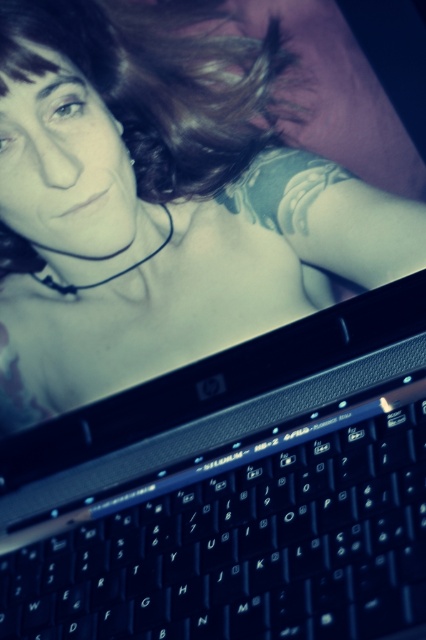
Question: Which object appears farthest from the camera in this image?

Choices:
 (A) matte black laptop at lower center
 (B) black plastic keyboard at bottom
 (C) dark brown curly hair at upper center

Answer: (C)

Question: Which of these objects is positioned closest to the dark brown curly hair at upper center?

Choices:
 (A) matte black laptop at lower center
 (B) black plastic keyboard at bottom

Answer: (A)

Question: Is matte black laptop at lower center bigger than black plastic keyboard at bottom?

Choices:
 (A) yes
 (B) no

Answer: (A)

Question: Does black plastic keyboard at bottom appear over dark brown curly hair at upper center?

Choices:
 (A) no
 (B) yes

Answer: (A)

Question: Is matte black laptop at lower center closer to the viewer compared to dark brown curly hair at upper center?

Choices:
 (A) no
 (B) yes

Answer: (B)

Question: Among these points, which one is farthest from the camera?

Choices:
 (A) (265, 144)
 (B) (423, 547)
 (C) (196, 266)

Answer: (C)